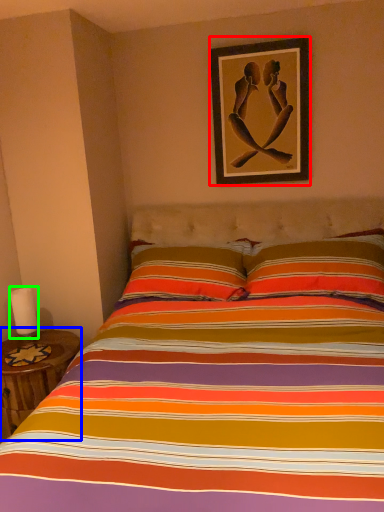
Question: Which object is positioned farthest from picture frame (highlighted by a red box)? Select from table (highlighted by a blue box) and candle (highlighted by a green box).

Choices:
 (A) table
 (B) candle

Answer: (B)